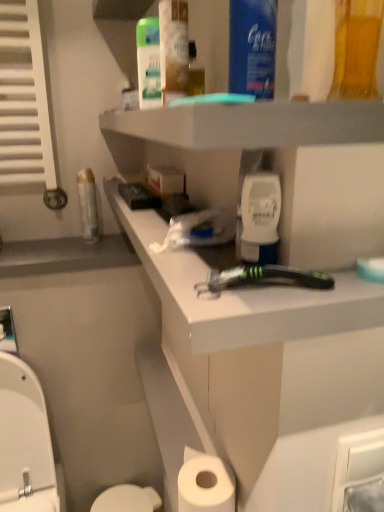
You are a GUI agent. You are given a task and a screenshot of the screen. Output one action in this format:
    pyautogui.click(x=<x>, y=<y>)
    Task: Click on the free spot to the right of clear plastic bottle at left, the 1th mouthwash viewed from the back
    Image resolution: width=384 pixels, height=512 pixels.
    Given the screenshot: What is the action you would take?
    pyautogui.click(x=114, y=243)